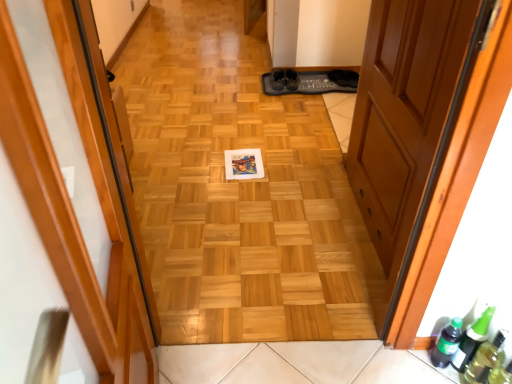
What do you see at coordinates (472, 340) in the screenshot? I see `green glass beer bottle at lower right, acting as the second beer bottle starting from the left` at bounding box center [472, 340].

What do you see at coordinates (485, 360) in the screenshot?
I see `transparent plastic bottle at lower right` at bounding box center [485, 360].

What do you see at coordinates (407, 123) in the screenshot?
I see `wooden door at center, the second door from the left` at bounding box center [407, 123].

Measure the distance between point (x=261, y=293) and camera.

They are 1.68 meters apart.

In order to click on green glass beer bottle at lower right, acting as the second beer bottle starting from the left in this screenshot , I will do `click(472, 340)`.

Looking at this image, from a real-world perspective, is green matte bottle at lower right, which is counted as the 1th beer bottle, starting from the left, positioned above or below transparent plastic bottle at lower right?

green matte bottle at lower right, which is counted as the 1th beer bottle, starting from the left, is situated lower than transparent plastic bottle at lower right in the real world.

Can you confirm if green matte bottle at lower right, which appears as the second beer bottle when viewed from the right, is taller than transparent plastic bottle at lower right?

Incorrect, the height of green matte bottle at lower right, which appears as the second beer bottle when viewed from the right, is not larger of that of transparent plastic bottle at lower right.

Looking at this image, is green matte bottle at lower right, which appears as the second beer bottle when viewed from the right, bigger or smaller than transparent plastic bottle at lower right?

In the image, green matte bottle at lower right, which appears as the second beer bottle when viewed from the right, appears to be smaller than transparent plastic bottle at lower right.

Find the location of `bottle below the green matte bottle at lower right, which is counted as the 1th beer bottle, starting from the left (from the image's perspective)`. bottle below the green matte bottle at lower right, which is counted as the 1th beer bottle, starting from the left (from the image's perspective) is located at coordinates (485, 360).

From the image's perspective, relative to wooden door at center, which appears as the second door when viewed from the right, is wooden floor at center above or below?

From the image's perspective, wooden floor at center appears above wooden door at center, which appears as the second door when viewed from the right.

Is point (120, 60) in front of point (95, 238)?

No, it is behind (95, 238).

Between wooden floor at center and wooden door at center, which appears as the second door when viewed from the right, which one has larger width?

wooden door at center, which appears as the second door when viewed from the right, is wider.

Which of these two, wooden floor at center or wooden door at center, which appears as the second door when viewed from the right, is bigger?

wooden door at center, which appears as the second door when viewed from the right, is bigger.

Can you tell me how much transparent plastic bottle at lower right and green glass beer bottle at lower right, positioned as the first beer bottle in right-to-left order, differ in facing direction?

The angular difference between transparent plastic bottle at lower right and green glass beer bottle at lower right, positioned as the first beer bottle in right-to-left order, is 7.77e-05 degrees.

Does transparent plastic bottle at lower right have a larger size compared to green glass beer bottle at lower right, acting as the second beer bottle starting from the left?

Actually, transparent plastic bottle at lower right might be smaller than green glass beer bottle at lower right, acting as the second beer bottle starting from the left.

Considering the positions of point (472, 378) and point (484, 319), is point (472, 378) closer or farther from the camera than point (484, 319)?

Point (472, 378).

Based on the photo, from the image's perspective, is transparent plastic bottle at lower right beneath green glass beer bottle at lower right, positioned as the first beer bottle in right-to-left order?

Yes, from the image's perspective, transparent plastic bottle at lower right is below green glass beer bottle at lower right, positioned as the first beer bottle in right-to-left order.

Is wooden door at center, the 1th door viewed from the left, spatially inside green glass beer bottle at lower right, acting as the second beer bottle starting from the left, or outside of it?

wooden door at center, the 1th door viewed from the left, is not enclosed by green glass beer bottle at lower right, acting as the second beer bottle starting from the left.

Considering the positions of objects wooden door at center, the 1th door viewed from the left, and green glass beer bottle at lower right, acting as the second beer bottle starting from the left, in the image provided, who is in front, wooden door at center, the 1th door viewed from the left, or green glass beer bottle at lower right, acting as the second beer bottle starting from the left,?

wooden door at center, the 1th door viewed from the left.

Considering the positions of objects wooden door at center, which appears as the second door when viewed from the right, and green glass beer bottle at lower right, positioned as the first beer bottle in right-to-left order, in the image provided, who is more to the left, wooden door at center, which appears as the second door when viewed from the right, or green glass beer bottle at lower right, positioned as the first beer bottle in right-to-left order,?

wooden door at center, which appears as the second door when viewed from the right, is more to the left.

Which is in front, green matte bottle at lower right, which is counted as the 1th beer bottle, starting from the left, or wooden floor at center?

wooden floor at center is in front.

Does green matte bottle at lower right, which appears as the second beer bottle when viewed from the right, have a lesser height compared to wooden floor at center?

Yes, green matte bottle at lower right, which appears as the second beer bottle when viewed from the right, is shorter than wooden floor at center.

Considering the relative sizes of green matte bottle at lower right, which is counted as the 1th beer bottle, starting from the left, and wooden floor at center in the image provided, is green matte bottle at lower right, which is counted as the 1th beer bottle, starting from the left, bigger than wooden floor at center?

No, green matte bottle at lower right, which is counted as the 1th beer bottle, starting from the left, is not bigger than wooden floor at center.

Can we say transparent plastic bottle at lower right lies outside green matte bottle at lower right, which appears as the second beer bottle when viewed from the right?

transparent plastic bottle at lower right lies outside green matte bottle at lower right, which appears as the second beer bottle when viewed from the right,'s area.

Can you tell me how much transparent plastic bottle at lower right and green matte bottle at lower right, which is counted as the 1th beer bottle, starting from the left, differ in facing direction?

transparent plastic bottle at lower right and green matte bottle at lower right, which is counted as the 1th beer bottle, starting from the left, are facing 0.000128 degrees away from each other.

From a real-world perspective, is transparent plastic bottle at lower right over green matte bottle at lower right, which appears as the second beer bottle when viewed from the right?

Yes, from a real-world perspective, transparent plastic bottle at lower right is above green matte bottle at lower right, which appears as the second beer bottle when viewed from the right.

Considering the sizes of objects transparent plastic bottle at lower right and green matte bottle at lower right, which appears as the second beer bottle when viewed from the right, in the image provided, who is wider, transparent plastic bottle at lower right or green matte bottle at lower right, which appears as the second beer bottle when viewed from the right,?

With larger width is transparent plastic bottle at lower right.

I want to click on beer bottle that appears on the right of green matte bottle at lower right, which appears as the second beer bottle when viewed from the right, so click(472, 340).

From the image's perspective, would you say green glass beer bottle at lower right, acting as the second beer bottle starting from the left, is shown under green matte bottle at lower right, which is counted as the 1th beer bottle, starting from the left?

No, from the image's perspective, green glass beer bottle at lower right, acting as the second beer bottle starting from the left, is not beneath green matte bottle at lower right, which is counted as the 1th beer bottle, starting from the left.

Considering the positions of objects green glass beer bottle at lower right, positioned as the first beer bottle in right-to-left order, and green matte bottle at lower right, which appears as the second beer bottle when viewed from the right, in the image provided, who is behind, green glass beer bottle at lower right, positioned as the first beer bottle in right-to-left order, or green matte bottle at lower right, which appears as the second beer bottle when viewed from the right,?

green matte bottle at lower right, which appears as the second beer bottle when viewed from the right, is further from the camera.

From a real-world perspective, is green glass beer bottle at lower right, positioned as the first beer bottle in right-to-left order, located beneath green matte bottle at lower right, which is counted as the 1th beer bottle, starting from the left?

Actually, green glass beer bottle at lower right, positioned as the first beer bottle in right-to-left order, is physically above green matte bottle at lower right, which is counted as the 1th beer bottle, starting from the left, in the real world.

At what (x,y) coordinates should I click in order to perform the action: click on bottle in front of the green matte bottle at lower right, which is counted as the 1th beer bottle, starting from the left. Please return your answer as a coordinate pair (x, y). This screenshot has height=384, width=512. Looking at the image, I should click on (485, 360).

Locate an element on the screen. The image size is (512, 384). plain lying behind the wooden door at center, which appears as the second door when viewed from the right is located at coordinates (239, 189).

From the picture: Estimate the real-world distances between objects in this image. Which object is further from wooden door at center, the 1th door viewed from the left, green matte bottle at lower right, which appears as the second beer bottle when viewed from the right, or green glass beer bottle at lower right, positioned as the first beer bottle in right-to-left order?

green glass beer bottle at lower right, positioned as the first beer bottle in right-to-left order.

Considering their positions, is green glass beer bottle at lower right, acting as the second beer bottle starting from the left, positioned closer to wooden door at center, which appears as the second door when viewed from the right, than wooden door at center, which ranks as the first door in right-to-left order?

wooden door at center, which ranks as the first door in right-to-left order, lies closer to wooden door at center, which appears as the second door when viewed from the right, than the other object.

Looking at the image, which one is located further to wooden door at center, the second door from the left, green matte bottle at lower right, which appears as the second beer bottle when viewed from the right, or wooden floor at center?

green matte bottle at lower right, which appears as the second beer bottle when viewed from the right, is further to wooden door at center, the second door from the left.

Estimate the real-world distances between objects in this image. Which object is closer to green glass beer bottle at lower right, positioned as the first beer bottle in right-to-left order, green matte bottle at lower right, which is counted as the 1th beer bottle, starting from the left, or wooden floor at center?

Among the two, green matte bottle at lower right, which is counted as the 1th beer bottle, starting from the left, is located nearer to green glass beer bottle at lower right, positioned as the first beer bottle in right-to-left order.

Which object lies further to the anchor point transparent plastic bottle at lower right, wooden door at center, which ranks as the first door in right-to-left order, or green glass beer bottle at lower right, acting as the second beer bottle starting from the left?

Based on the image, wooden door at center, which ranks as the first door in right-to-left order, appears to be further to transparent plastic bottle at lower right.

Based on their spatial positions, is transparent plastic bottle at lower right or wooden door at center, the second door from the left, further from wooden floor at center?

Among the two, transparent plastic bottle at lower right is located further to wooden floor at center.

Estimate the real-world distances between objects in this image. Which object is further from green glass beer bottle at lower right, positioned as the first beer bottle in right-to-left order, wooden door at center, which ranks as the first door in right-to-left order, or transparent plastic bottle at lower right?

wooden door at center, which ranks as the first door in right-to-left order, is further to green glass beer bottle at lower right, positioned as the first beer bottle in right-to-left order.

When comparing their distances from wooden door at center, the 1th door viewed from the left, does green glass beer bottle at lower right, acting as the second beer bottle starting from the left, or transparent plastic bottle at lower right seem closer?

green glass beer bottle at lower right, acting as the second beer bottle starting from the left, lies closer to wooden door at center, the 1th door viewed from the left, than the other object.

Find the location of `plain between wooden door at center, the 1th door viewed from the left, and transparent plastic bottle at lower right from front to back`. plain between wooden door at center, the 1th door viewed from the left, and transparent plastic bottle at lower right from front to back is located at coordinates (239, 189).

At what (x,y) coordinates should I click in order to perform the action: click on plain between wooden door at center, which ranks as the first door in right-to-left order, and transparent plastic bottle at lower right from top to bottom. Please return your answer as a coordinate pair (x, y). Looking at the image, I should click on (239, 189).

Find the location of a particular element. plain between wooden door at center, which appears as the second door when viewed from the right, and green glass beer bottle at lower right, acting as the second beer bottle starting from the left, in the front-back direction is located at coordinates [x=239, y=189].

At what (x,y) coordinates should I click in order to perform the action: click on beer bottle between wooden door at center, the second door from the left, and green matte bottle at lower right, which is counted as the 1th beer bottle, starting from the left, in the up-down direction. Please return your answer as a coordinate pair (x, y). This screenshot has height=384, width=512. Looking at the image, I should click on (472, 340).